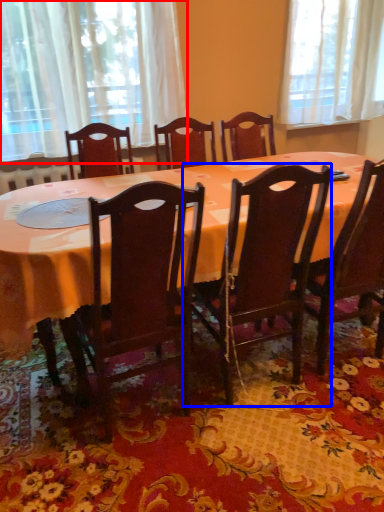
Question: Which of the following is the farthest to the observer, curtain (highlighted by a red box) or chair (highlighted by a blue box)?

Choices:
 (A) curtain
 (B) chair

Answer: (A)